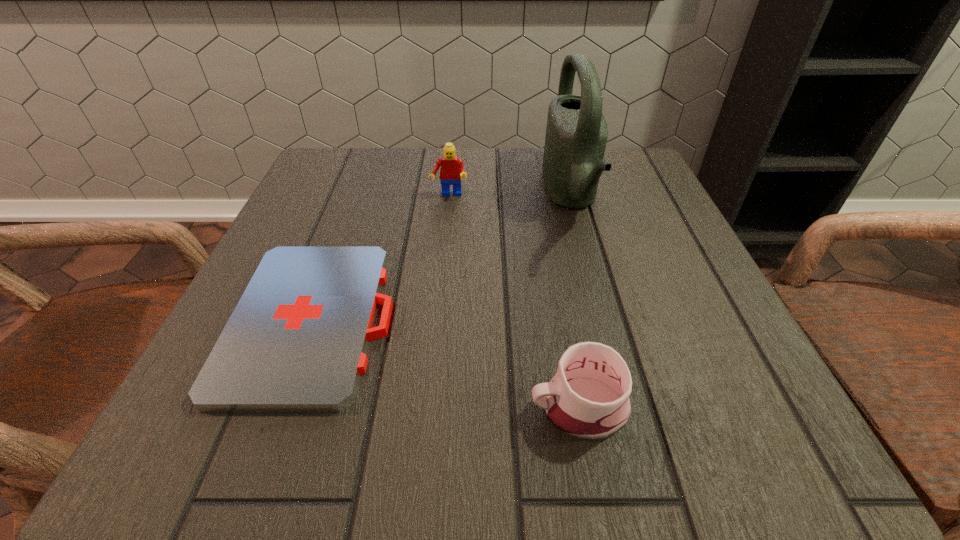
The height and width of the screenshot is (540, 960). I want to click on free space between the Lego and the second shortest object, so click(x=514, y=301).

At what (x,y) coordinates should I click in order to perform the action: click on free spot between the second object from left to right and the tallest object. Please return your answer as a coordinate pair (x, y). Looking at the image, I should click on (510, 195).

You are a GUI agent. You are given a task and a screenshot of the screen. Output one action in this format:
    pyautogui.click(x=<x>, y=<y>)
    Task: Click on the vacant point located between the watering can and the second shortest object
    The width and height of the screenshot is (960, 540).
    Given the screenshot: What is the action you would take?
    pyautogui.click(x=574, y=301)

Where is `vacant region between the tallest object and the first-aid kit`? Image resolution: width=960 pixels, height=540 pixels. vacant region between the tallest object and the first-aid kit is located at coordinates (443, 257).

Where is `free space that is in between the watering can and the shortest object`? Image resolution: width=960 pixels, height=540 pixels. free space that is in between the watering can and the shortest object is located at coordinates (443, 257).

Where is `free space between the watering can and the shortest object`? This screenshot has width=960, height=540. free space between the watering can and the shortest object is located at coordinates (443, 257).

In order to click on empty space that is in between the watering can and the second tallest object in this screenshot , I will do `click(510, 195)`.

The image size is (960, 540). Identify the location of free space between the leftmost object and the tallest object. (443, 257).

You are a GUI agent. You are given a task and a screenshot of the screen. Output one action in this format:
    pyautogui.click(x=<x>, y=<y>)
    Task: Click on the free space between the watering can and the first-aid kit
    This screenshot has width=960, height=540.
    Given the screenshot: What is the action you would take?
    click(443, 257)

Locate an element on the screen. This screenshot has height=540, width=960. object that is the closest to the mug is located at coordinates (296, 341).